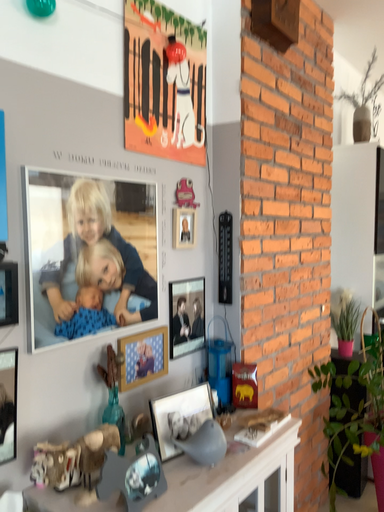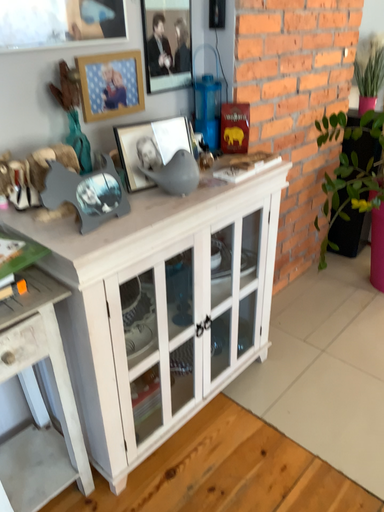
Question: Which way did the camera rotate in the video?

Choices:
 (A) rotated upward
 (B) rotated downward

Answer: (B)